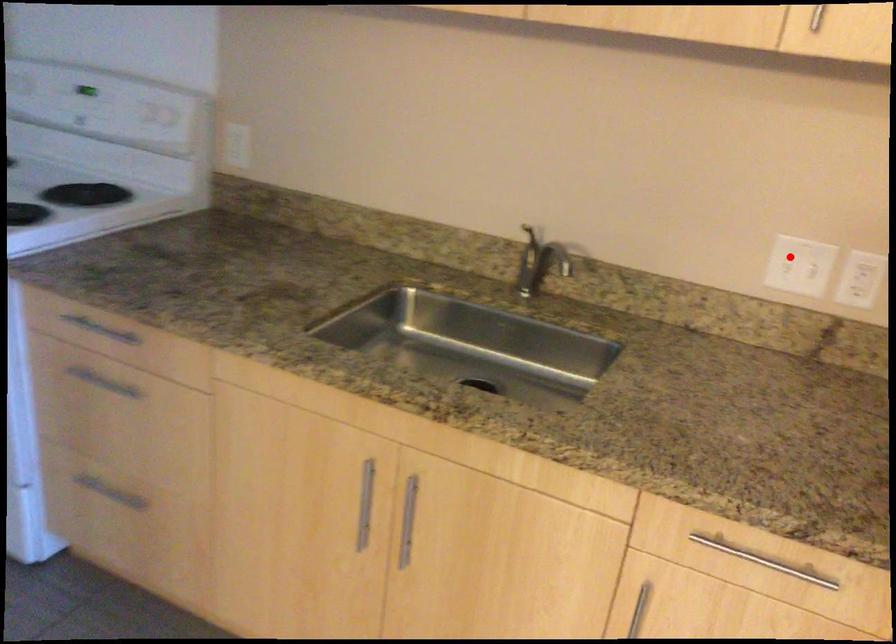
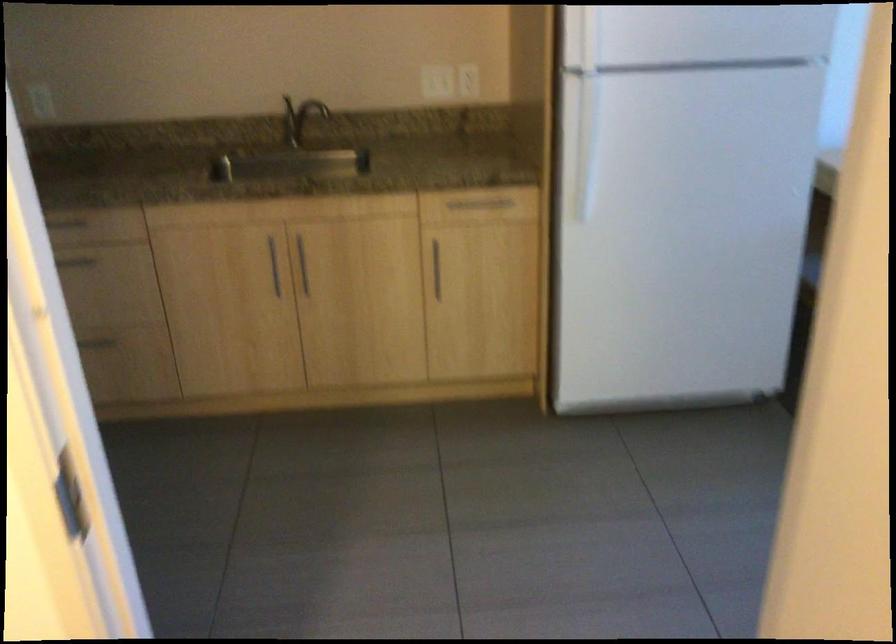
In the second image, find the point that corresponds to the highlighted location in the first image.

(433, 80)